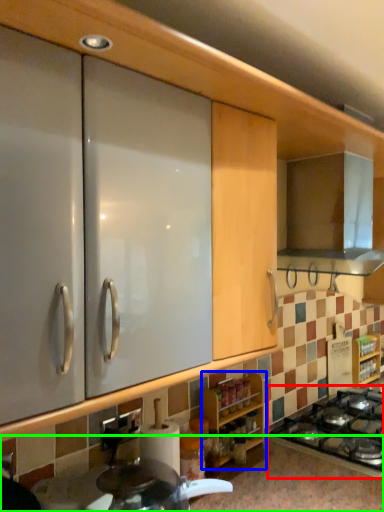
Question: Which object is positioned farthest from gas stove (highlighted by a red box)? Select from cabinetry (highlighted by a blue box) and countertop (highlighted by a green box).

Choices:
 (A) cabinetry
 (B) countertop

Answer: (A)